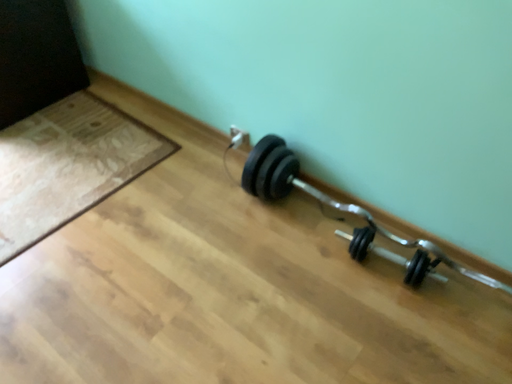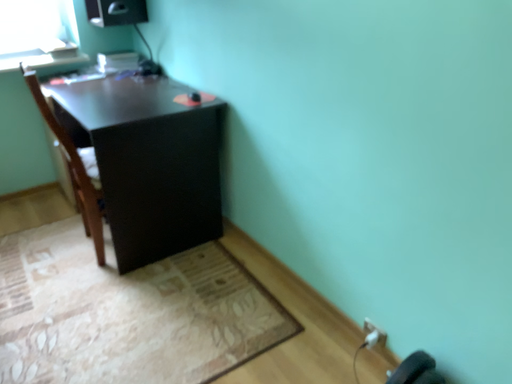
Question: Which way did the camera rotate in the video?

Choices:
 (A) rotated left
 (B) rotated right

Answer: (A)